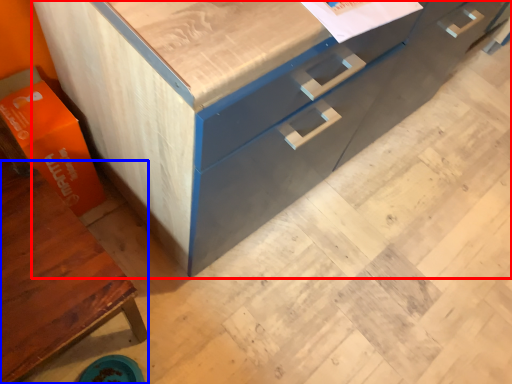
Question: Which object appears farthest to the camera in this image, chest of drawers (highlighted by a red box) or cabinetry (highlighted by a blue box)?

Choices:
 (A) chest of drawers
 (B) cabinetry

Answer: (A)